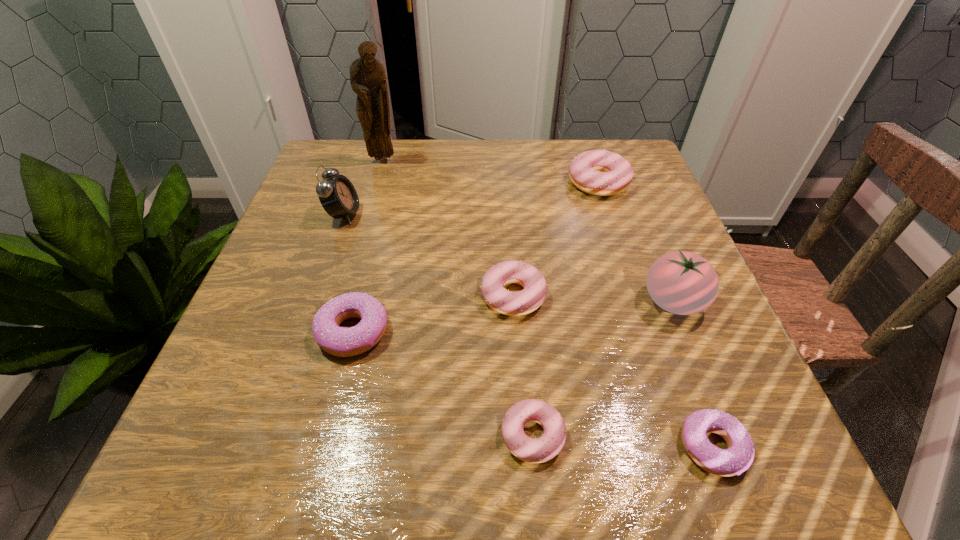
The image size is (960, 540). Find the location of `figurine`. figurine is located at coordinates (368, 80).

Identify the location of the sixth nearest object. (337, 195).

Locate an element on the screen. white alarm clock is located at coordinates (337, 195).

The height and width of the screenshot is (540, 960). Find the location of `red tomato`. red tomato is located at coordinates (680, 282).

I want to click on the tallest doughnut, so click(598, 172).

Where is `the rightmost pink doughnut`? the rightmost pink doughnut is located at coordinates (598, 172).

Where is `the bigger purple doughnut`? This screenshot has width=960, height=540. the bigger purple doughnut is located at coordinates (344, 342).

Locate an element on the screen. The width and height of the screenshot is (960, 540). the left purple doughnut is located at coordinates (344, 342).

Identify the location of the second nearest pink doughnut. (506, 302).

Find the location of a particular element. This screenshot has width=960, height=540. the nearer purple doughnut is located at coordinates (739, 456).